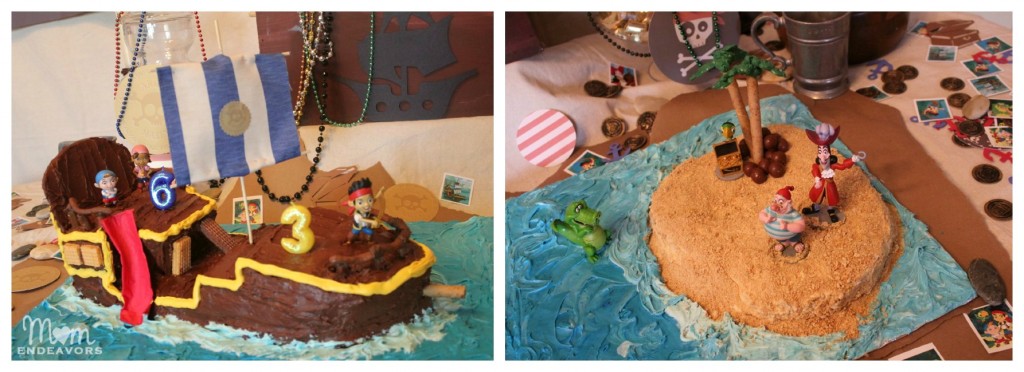
Locate an element on the screen. This screenshot has width=1024, height=372. toy is located at coordinates (828, 190).